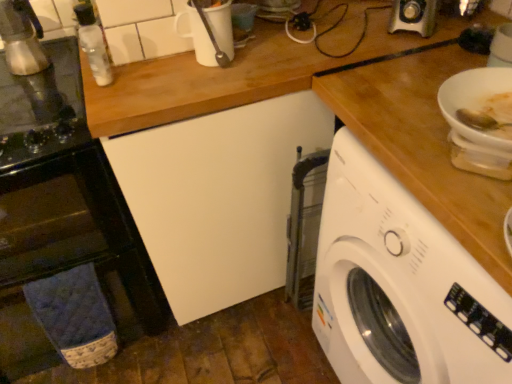
Where is `unoccupied area in front of clear glass bottle at upper left`? Image resolution: width=512 pixels, height=384 pixels. unoccupied area in front of clear glass bottle at upper left is located at coordinates (109, 89).